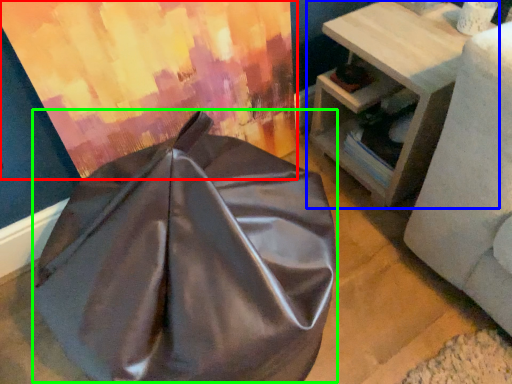
Question: Which is farther away from curtain (highlighted by a red box)? table (highlighted by a blue box) or bean bag chair (highlighted by a green box)?

Choices:
 (A) table
 (B) bean bag chair

Answer: (A)